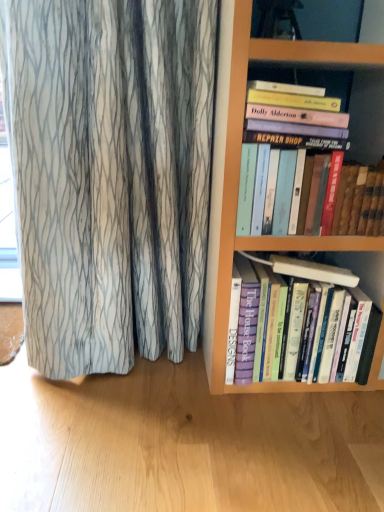
Question: Which direction should I rotate to look at purple hardcover book at center, the first book positioned from the bottom?

Choices:
 (A) right
 (B) left

Answer: (A)

Question: Is hardcover books at upper right, marked as the 2th book in a bottom-to-top arrangement, next to purple hardcover book at center, the first book positioned from the bottom?

Choices:
 (A) yes
 (B) no

Answer: (B)

Question: Is hardcover books at upper right, marked as the 2th book in a bottom-to-top arrangement, facing away from purple hardcover book at center, the second book when ordered from top to bottom?

Choices:
 (A) no
 (B) yes

Answer: (A)

Question: Is hardcover books at upper right, marked as the 2th book in a bottom-to-top arrangement, surrounding purple hardcover book at center, the first book positioned from the bottom?

Choices:
 (A) yes
 (B) no

Answer: (B)

Question: Is hardcover books at upper right, which is the first book in top-to-bottom order, in front of purple hardcover book at center, the second book when ordered from top to bottom?

Choices:
 (A) yes
 (B) no

Answer: (A)

Question: Does hardcover books at upper right, which is the first book in top-to-bottom order, have a lesser height compared to purple hardcover book at center, the first book positioned from the bottom?

Choices:
 (A) no
 (B) yes

Answer: (B)

Question: From a real-world perspective, is hardcover books at upper right, marked as the 2th book in a bottom-to-top arrangement, physically above purple hardcover book at center, the second book when ordered from top to bottom?

Choices:
 (A) yes
 (B) no

Answer: (A)

Question: Does purple hardcover book at center, the second book when ordered from top to bottom, come behind hardcover books at upper right, marked as the 2th book in a bottom-to-top arrangement?

Choices:
 (A) yes
 (B) no

Answer: (A)

Question: Considering the relative positions of purple hardcover book at center, the second book when ordered from top to bottom, and hardcover books at upper right, which is the first book in top-to-bottom order, in the image provided, is purple hardcover book at center, the second book when ordered from top to bottom, to the right of hardcover books at upper right, which is the first book in top-to-bottom order, from the viewer's perspective?

Choices:
 (A) yes
 (B) no

Answer: (B)

Question: From the image's perspective, is purple hardcover book at center, the first book positioned from the bottom, beneath hardcover books at upper right, marked as the 2th book in a bottom-to-top arrangement?

Choices:
 (A) yes
 (B) no

Answer: (A)

Question: Is purple hardcover book at center, the first book positioned from the bottom, shorter than hardcover books at upper right, marked as the 2th book in a bottom-to-top arrangement?

Choices:
 (A) no
 (B) yes

Answer: (A)

Question: From a real-world perspective, is purple hardcover book at center, the first book positioned from the bottom, beneath hardcover books at upper right, marked as the 2th book in a bottom-to-top arrangement?

Choices:
 (A) no
 (B) yes

Answer: (B)

Question: Is purple hardcover book at center, the first book positioned from the bottom, closer to the viewer compared to hardcover books at upper right, marked as the 2th book in a bottom-to-top arrangement?

Choices:
 (A) yes
 (B) no

Answer: (B)

Question: From the image's perspective, is hardcover books at upper right, which is the first book in top-to-bottom order, above or below purple hardcover book at center, the second book when ordered from top to bottom?

Choices:
 (A) below
 (B) above

Answer: (B)